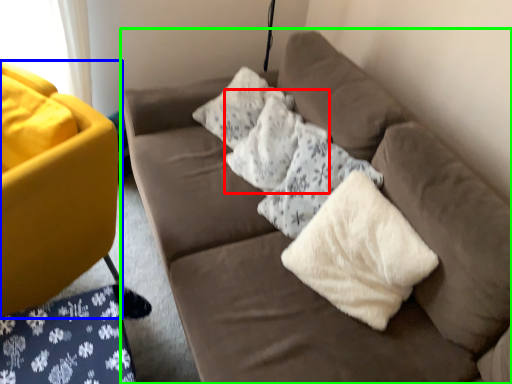
Question: Estimate the real-world distances between objects in this image. Which object is closer to pillow (highlighted by a red box), studio couch (highlighted by a blue box) or studio couch (highlighted by a green box)?

Choices:
 (A) studio couch
 (B) studio couch

Answer: (B)